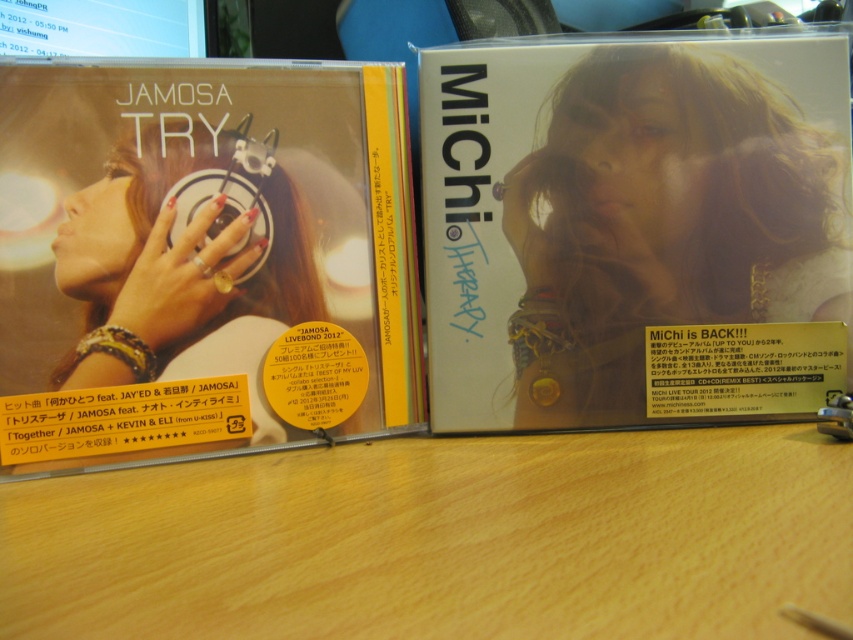
You are organizing a music collection and need to place the matte white cd at center on the wooden table at center. Based on the scene description, will the CD fit on the table without overhanging the edges?

The matte white cd at center has a greater height compared to wooden table at center, which means the CD is taller than the table. Since height is a vertical measurement, this might indicate that the CD cannot be placed on the table without overhanging the edges due to its greater height.

In the scene shown: You are a collector organizing CDs on a shelf. You have a matte black cd at left and a matte white cd at center. Which CD should you move to make space for a new CD that requires more room? Explain your choice based on their positions.

The matte black cd at left is closer to the viewer than the matte white cd at center. To make space for the new CD, you should move the matte white cd at center since it is further back and might allow more room when shifted forward.

You are organizing a music collection and need to place the matte black cd at left and the matte white cd at center into a storage box. The box has a divider that separates items into left and right compartments. If you want to keep their original arrangement as shown in the image, which cd should go into the left compartment?

The matte black cd at left should go into the left compartment because it was originally positioned on the left side of the matte white cd at center.